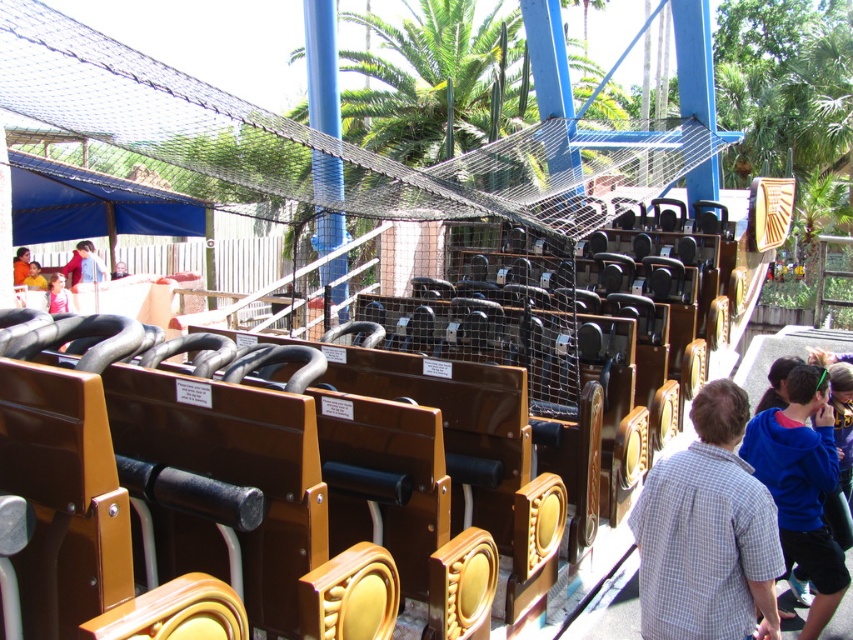
In the scene shown: Which is more to the right, white checkered shirt at center or orange shirt at lower left?

Positioned to the right is white checkered shirt at center.

Is point (776, 552) more distant than point (24, 246)?

No, it is in front of (24, 246).

What do you see at coordinates (706, 532) in the screenshot? I see `white checkered shirt at center` at bounding box center [706, 532].

The width and height of the screenshot is (853, 640). What are the coordinates of `white checkered shirt at center` in the screenshot? It's located at (706, 532).

Is blue fleece jacket at lower right positioned behind orange shirt at lower left?

No, blue fleece jacket at lower right is in front of orange shirt at lower left.

Does blue fleece jacket at lower right appear on the left side of orange shirt at lower left?

Incorrect, blue fleece jacket at lower right is not on the left side of orange shirt at lower left.

At what (x,y) coordinates should I click in order to perform the action: click on blue fleece jacket at lower right. Please return your answer as a coordinate pair (x, y). The image size is (853, 640). Looking at the image, I should click on (802, 484).

This screenshot has width=853, height=640. What do you see at coordinates (802, 484) in the screenshot?
I see `blue fleece jacket at lower right` at bounding box center [802, 484].

Does point (813, 502) come in front of point (39, 284)?

Yes, point (813, 502) is closer to viewer.

Identify the location of blue fleece jacket at lower right. This screenshot has height=640, width=853. (802, 484).